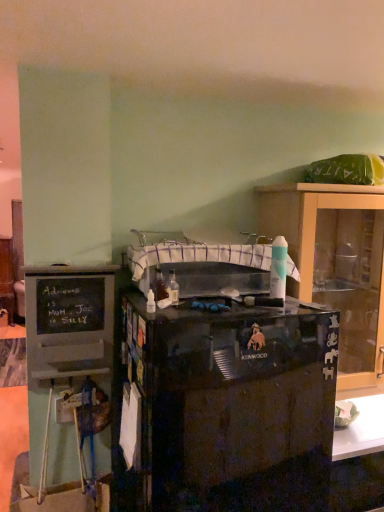
Question: From the image's perspective, is black glossy kenwood mixer at center positioned above or below matte black kenwood mixer at right, the 2th cabinetry from the left?

Choices:
 (A) above
 (B) below

Answer: (B)

Question: In terms of size, does black glossy kenwood mixer at center appear bigger or smaller than matte black kenwood mixer at right, which is the 1th cabinetry from back to front?

Choices:
 (A) small
 (B) big

Answer: (B)

Question: Based on their relative distances, which object is farther from the matte black kenwood mixer at right, which is the 1th cabinetry from back to front?

Choices:
 (A) black chalkboard cabinet at left, marked as the 2th cabinetry in a back-to-front arrangement
 (B) black glossy kenwood mixer at center
 (C) white fabric sink at center

Answer: (A)

Question: Which is farther from the black glossy kenwood mixer at center?

Choices:
 (A) white fabric sink at center
 (B) black chalkboard cabinet at left, which is the 1th cabinetry from front to back
 (C) matte black kenwood mixer at right, the first cabinetry from the right

Answer: (C)